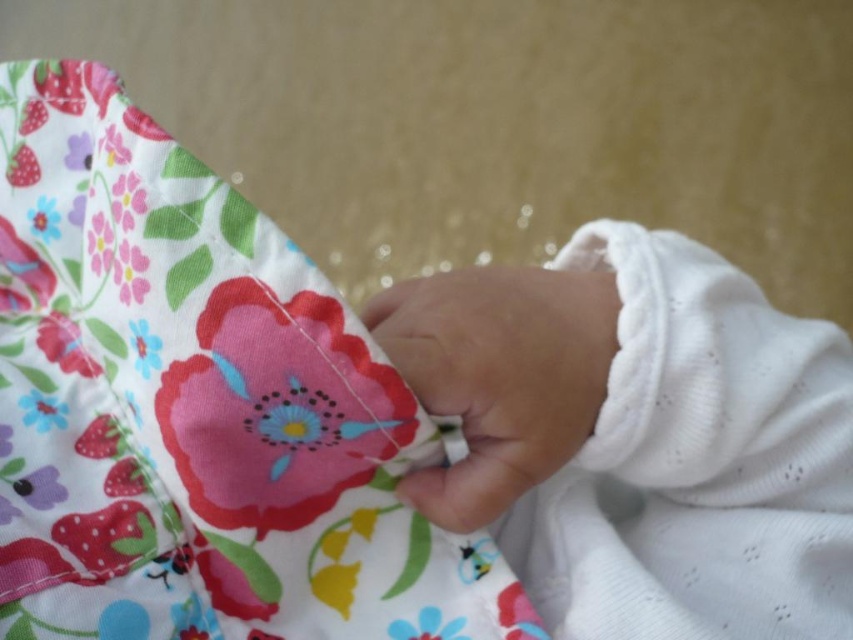
Question: Is white soft fabric at center thinner than smooth white hand at center?

Choices:
 (A) yes
 (B) no

Answer: (B)

Question: Which object is farther from the camera taking this photo?

Choices:
 (A) floral fabric at center
 (B) smooth white hand at center

Answer: (B)

Question: Which object appears farthest from the camera in this image?

Choices:
 (A) floral fabric at center
 (B) white soft fabric at center
 (C) smooth white hand at center

Answer: (B)

Question: Is floral fabric at center smaller than white soft fabric at center?

Choices:
 (A) no
 (B) yes

Answer: (A)

Question: Among these points, which one is nearest to the camera?

Choices:
 (A) (328, 364)
 (B) (607, 276)
 (C) (788, 436)

Answer: (A)

Question: Can you confirm if white soft fabric at center is bigger than smooth white hand at center?

Choices:
 (A) no
 (B) yes

Answer: (B)